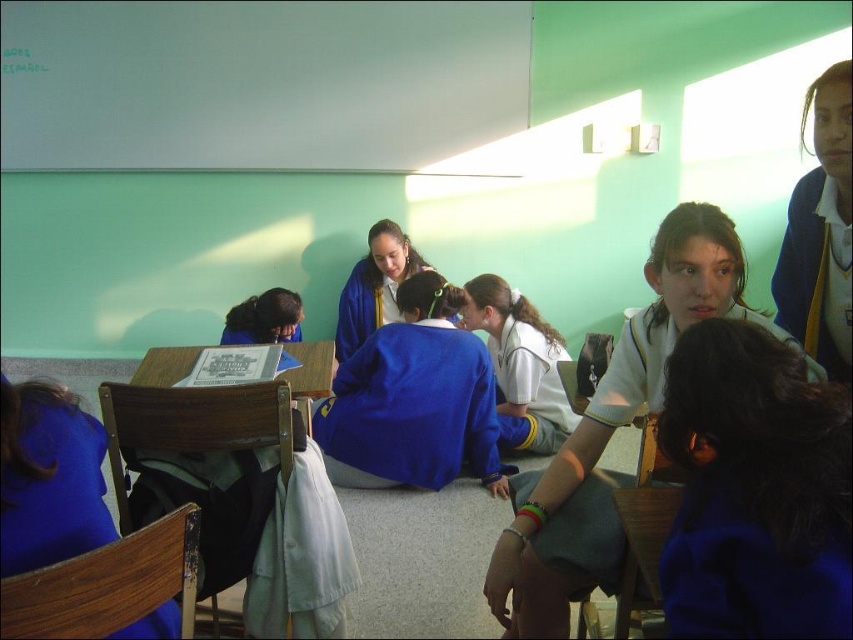
Question: Can you confirm if blue fabric jacket at upper right is thinner than blue uniform at center?

Choices:
 (A) yes
 (B) no

Answer: (A)

Question: Does white jersey at center have a lesser width compared to blue fabric jacket at center?

Choices:
 (A) no
 (B) yes

Answer: (B)

Question: Which point is farther from the camera taking this photo?

Choices:
 (A) (437, 285)
 (B) (848, 296)

Answer: (A)

Question: Can you confirm if blue fabric at center is bigger than blue fabric jacket at upper right?

Choices:
 (A) no
 (B) yes

Answer: (A)

Question: Among these objects, which one is farthest from the camera?

Choices:
 (A) blue fabric jacket at center
 (B) blue fabric at center
 (C) blue uniform at center
 (D) white jersey at center

Answer: (C)

Question: Which is farther from the blue fabric jacket at center?

Choices:
 (A) blue fabric at center
 (B) blue fabric jacket at upper right
 (C) blue uniform at center
 (D) white jersey at center

Answer: (A)